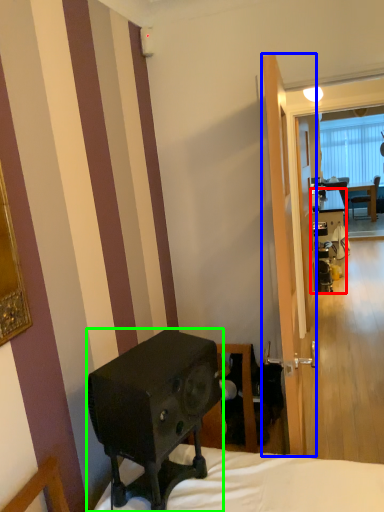
Question: Estimate the real-world distances between objects in this image. Which object is farther from desk (highlighted by a red box), screen door (highlighted by a blue box) or loudspeaker (highlighted by a green box)?

Choices:
 (A) screen door
 (B) loudspeaker

Answer: (B)